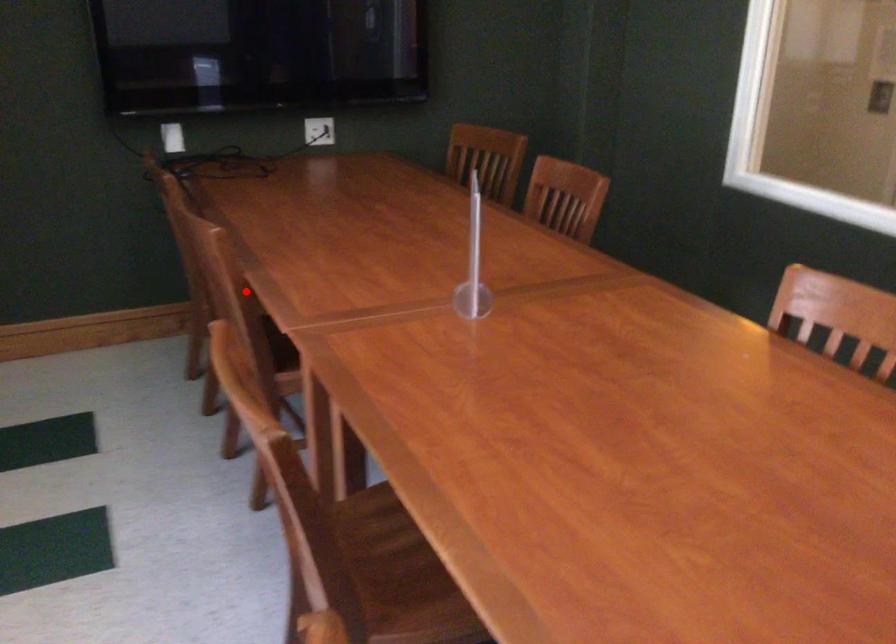
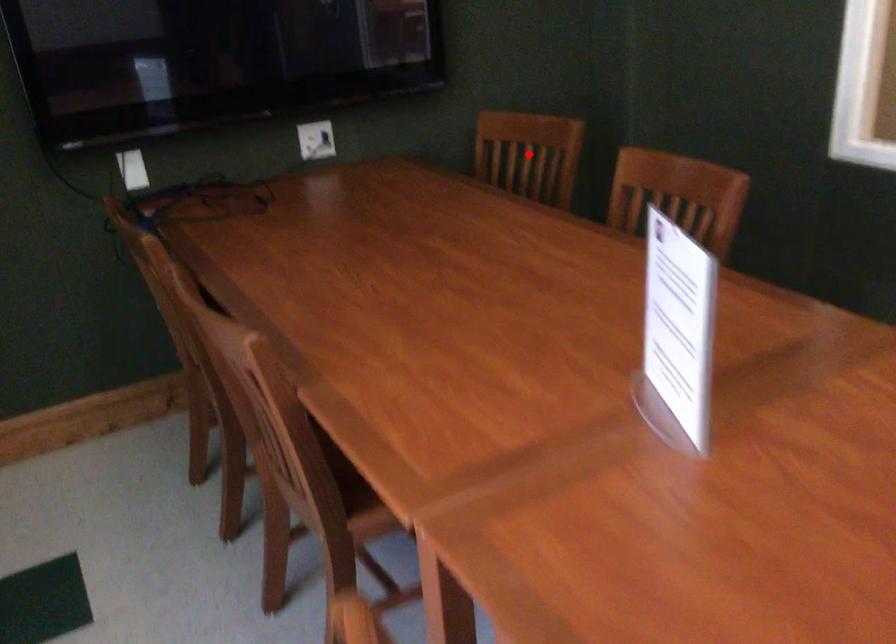
I am providing you with two images of the same scene from different viewpoints. A red point is marked on the first image and another point is marked on the second image. Are the points marked in image1 and image2 representing the same 3D position?

No